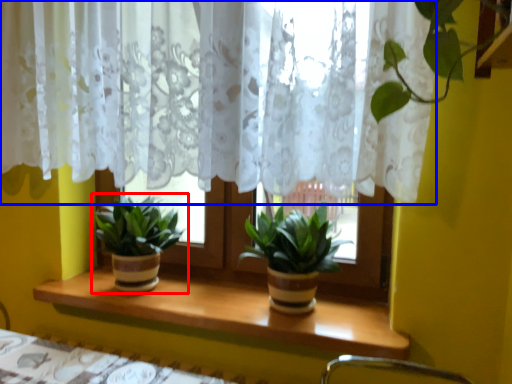
Question: Which object appears closest to the camera in this image, houseplant (highlighted by a red box) or curtain (highlighted by a blue box)?

Choices:
 (A) houseplant
 (B) curtain

Answer: (B)